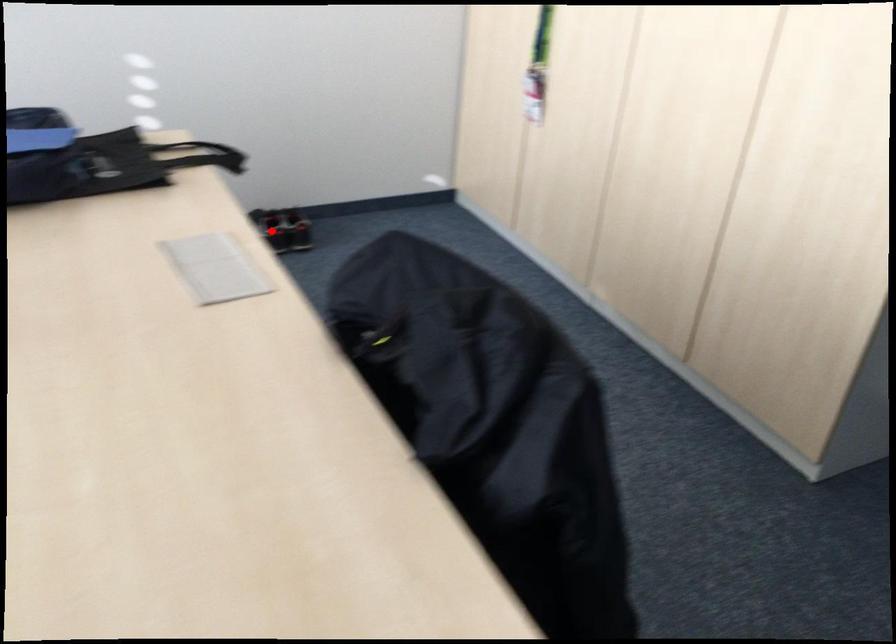
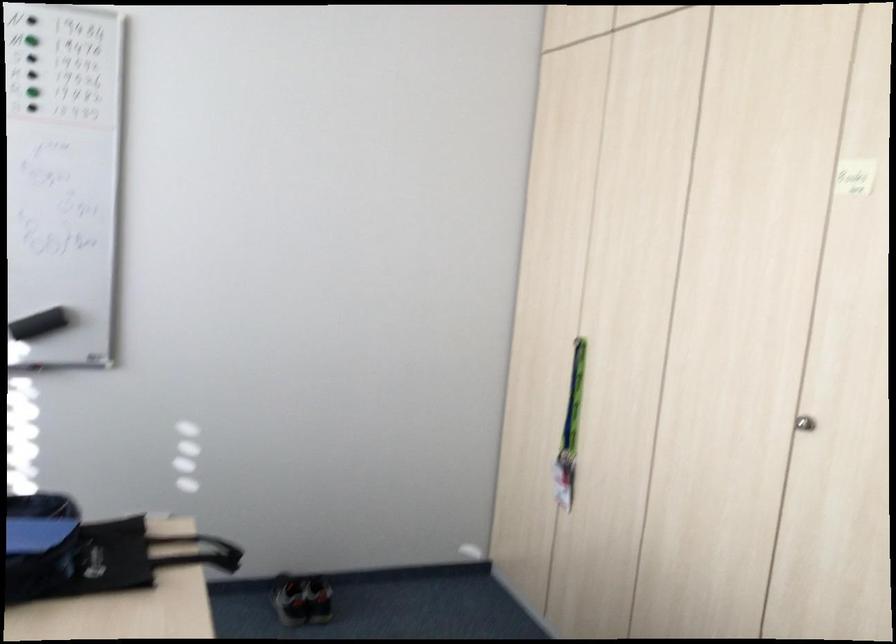
Locate, in the second image, the point that corresponds to the highlighted location in the first image.

(289, 599)